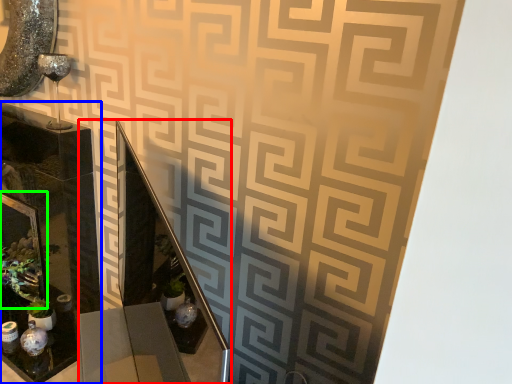
Question: Estimate the real-world distances between objects in this image. Which object is closer to vanity (highlighted by a red box), glass box (highlighted by a blue box) or picture frame (highlighted by a green box)?

Choices:
 (A) glass box
 (B) picture frame

Answer: (A)